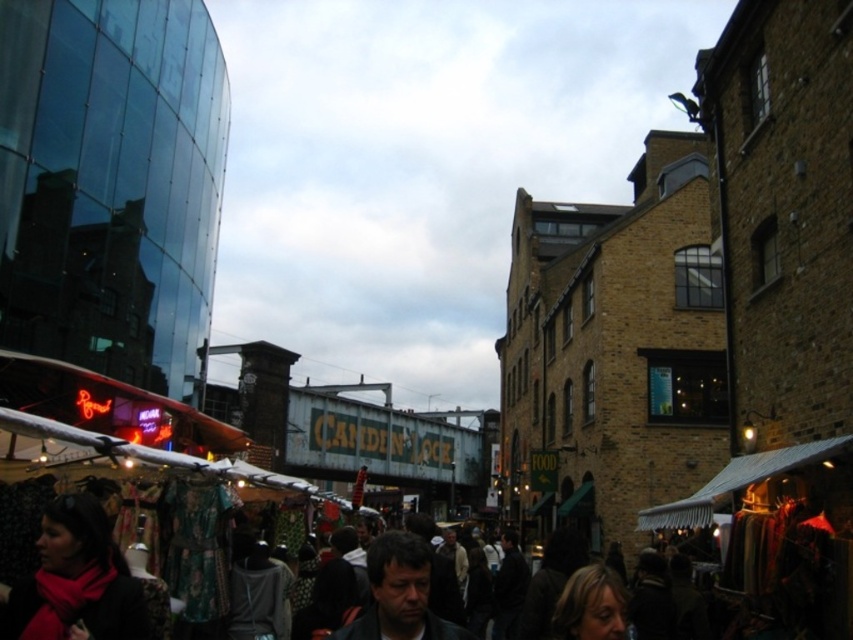
You are a photographer standing in the middle of the Camden Lock market. You notice two items of interest in your viewfinder. The first is the matte red scarf at lower left and the second is the dark brown hair at center. Which item is positioned more to the left side of your viewfinder?

The matte red scarf at lower left is positioned more to the left side of your viewfinder than the dark brown hair at center.

In the scene shown: You are a photographer standing at the entrance of the Camden Lock market. You notice a matte red scarf at lower left and a dark brown hair at center. Which object is positioned higher from the ground?

The matte red scarf at lower left is above dark brown hair at center, so the matte red scarf at lower left is higher from the ground.

You are a customer at the Camden Lock market, looking to buy a matte red scarf at lower left. You want to know if it will be visible from the dark brown hair at center. Can you see it?

The matte red scarf at lower left is shorter than the dark brown hair at center, so it might be partially obscured depending on the angle, but since the scarf is at lower left and the hair is at center, it could still be visible from that position.